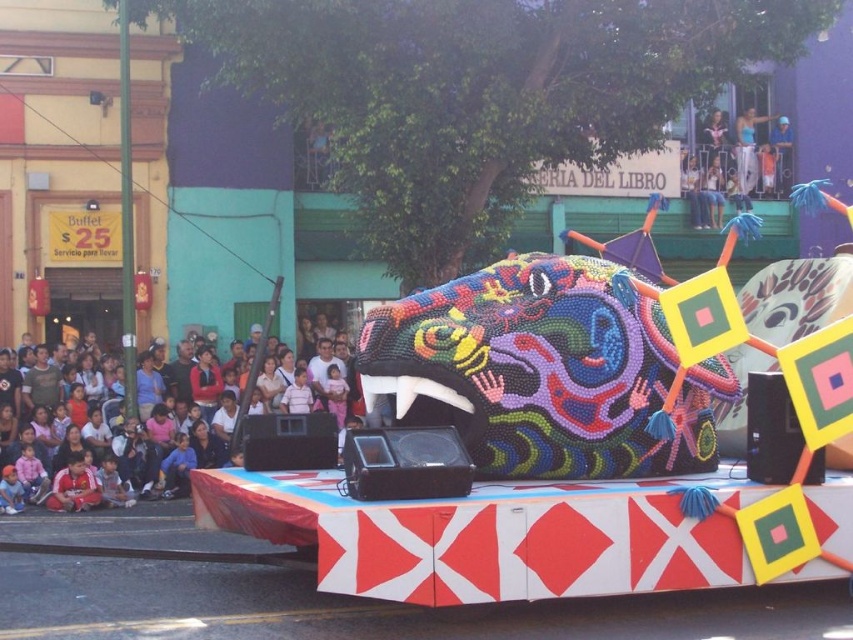
Question: In this image, where is multicolored fabric crowd at lower left located relative to light blue jeans at upper center?

Choices:
 (A) above
 (B) below

Answer: (B)

Question: Is white fabric pants at upper right positioned at the back of light blue jeans at upper center?

Choices:
 (A) no
 (B) yes

Answer: (B)

Question: Which object appears closest to the camera in this image?

Choices:
 (A) multicolored fabric crowd at lower left
 (B) blue fabric shirt at upper right

Answer: (A)

Question: Among these objects, which one is farthest from the camera?

Choices:
 (A) light blue jeans at upper center
 (B) multicolored fabric crowd at lower left
 (C) multicolored beaded sculpture at center

Answer: (A)

Question: Is multicolored beaded sculpture at center wider than white fabric pants at upper right?

Choices:
 (A) yes
 (B) no

Answer: (A)

Question: Estimate the real-world distances between objects in this image. Which object is closer to the light blue jeans at upper center?

Choices:
 (A) multicolored beaded sculpture at center
 (B) multicolored fabric crowd at lower left

Answer: (B)